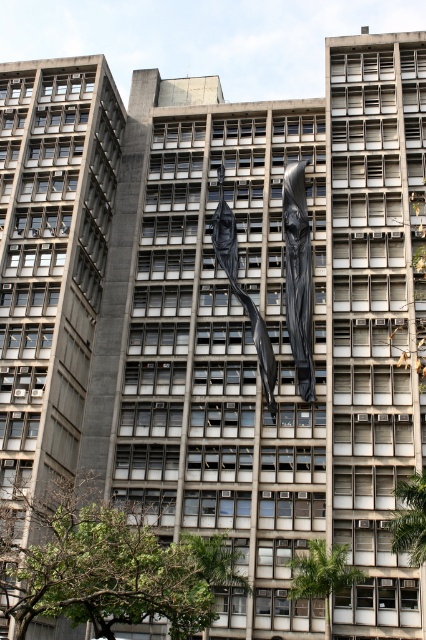
Question: Which of the following is the closest to the observer?

Choices:
 (A) (294, 260)
 (B) (215, 209)

Answer: (A)

Question: Can you confirm if black glossy statue at center is positioned to the right of black matte sculpture at center?

Choices:
 (A) yes
 (B) no

Answer: (A)

Question: Where is black glossy statue at center located in relation to black matte sculpture at center in the image?

Choices:
 (A) right
 (B) left

Answer: (A)

Question: Which point is closer to the camera taking this photo?

Choices:
 (A) coord(236,289)
 (B) coord(293,260)

Answer: (B)

Question: Which of the following is the closest to the observer?

Choices:
 (A) (304, 264)
 (B) (270, 358)

Answer: (B)

Question: Does black glossy statue at center appear under black matte sculpture at center?

Choices:
 (A) yes
 (B) no

Answer: (B)